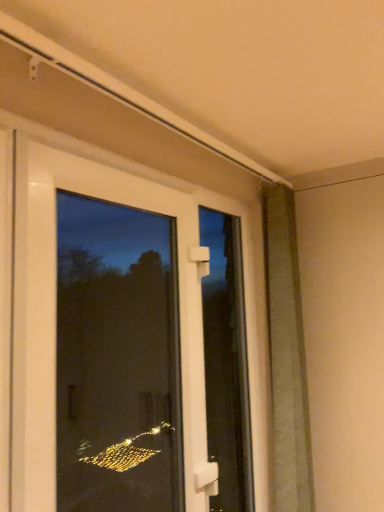
Question: Does white plastic door at center have a larger size compared to green textured curtain at right?

Choices:
 (A) no
 (B) yes

Answer: (B)

Question: Is white plastic door at center at the left side of green textured curtain at right?

Choices:
 (A) no
 (B) yes

Answer: (B)

Question: Does white plastic door at center have a lesser width compared to green textured curtain at right?

Choices:
 (A) yes
 (B) no

Answer: (A)

Question: From the image's perspective, is white plastic door at center on green textured curtain at right?

Choices:
 (A) yes
 (B) no

Answer: (A)

Question: From a real-world perspective, is white plastic door at center located higher than green textured curtain at right?

Choices:
 (A) no
 (B) yes

Answer: (B)

Question: Is point (246, 218) positioned closer to the camera than point (218, 234)?

Choices:
 (A) closer
 (B) farther

Answer: (A)

Question: Visually, is white plastic door at center positioned to the left or to the right of white plastic handle at center?

Choices:
 (A) right
 (B) left

Answer: (B)

Question: Considering the positions of white plastic door at center and white plastic handle at center in the image, is white plastic door at center bigger or smaller than white plastic handle at center?

Choices:
 (A) big
 (B) small

Answer: (A)

Question: Is white plastic door at center wider or thinner than white plastic handle at center?

Choices:
 (A) thin
 (B) wide

Answer: (B)

Question: Is white plastic handle at center wider or thinner than green textured curtain at right?

Choices:
 (A) wide
 (B) thin

Answer: (B)

Question: From the image's perspective, is white plastic handle at center positioned above or below green textured curtain at right?

Choices:
 (A) below
 (B) above

Answer: (A)

Question: Considering the positions of point (236, 389) and point (304, 504), is point (236, 389) closer or farther from the camera than point (304, 504)?

Choices:
 (A) farther
 (B) closer

Answer: (A)

Question: In terms of height, does white plastic handle at center look taller or shorter compared to green textured curtain at right?

Choices:
 (A) tall
 (B) short

Answer: (B)

Question: Is green textured curtain at right to the left or to the right of white plastic handle at center in the image?

Choices:
 (A) left
 (B) right

Answer: (B)

Question: Considering their positions, is green textured curtain at right located in front of or behind white plastic handle at center?

Choices:
 (A) front
 (B) behind

Answer: (B)